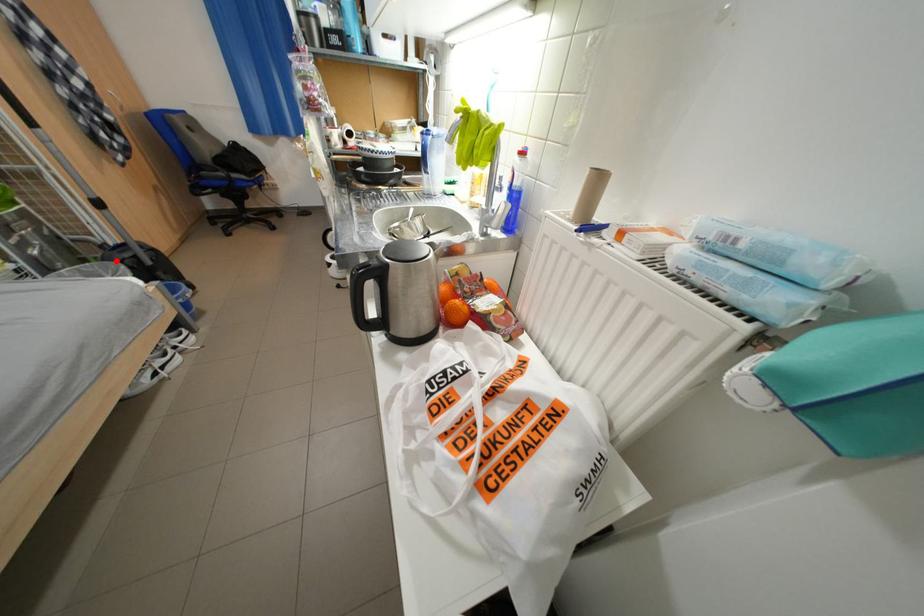
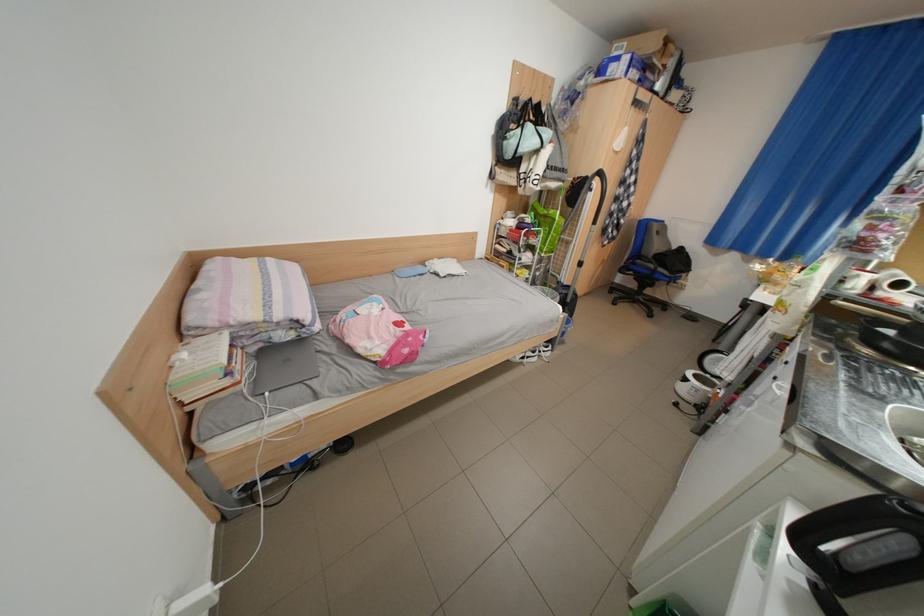
Find the pixel in the second image that matches the highlighted location in the first image.

(565, 291)